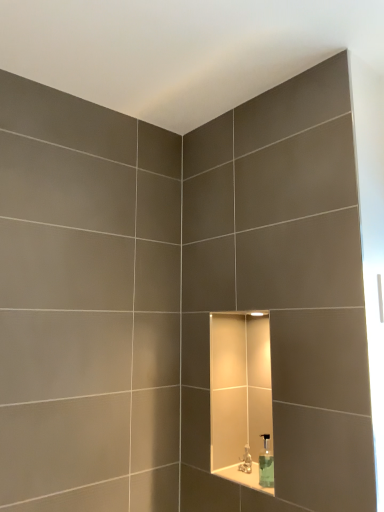
Question: Considering the relative positions of white glossy ledge at center and clear glass soap dispenser at center in the image provided, is white glossy ledge at center to the left of clear glass soap dispenser at center from the viewer's perspective?

Choices:
 (A) no
 (B) yes

Answer: (B)

Question: Does white glossy ledge at center have a greater height compared to clear glass soap dispenser at center?

Choices:
 (A) yes
 (B) no

Answer: (B)

Question: Is white glossy ledge at center directly adjacent to clear glass soap dispenser at center?

Choices:
 (A) no
 (B) yes

Answer: (B)

Question: Is white glossy ledge at center positioned with its back to clear glass soap dispenser at center?

Choices:
 (A) no
 (B) yes

Answer: (A)

Question: Does white glossy ledge at center have a larger size compared to clear glass soap dispenser at center?

Choices:
 (A) no
 (B) yes

Answer: (A)

Question: From the image's perspective, is white glossy ledge at center located above clear glass soap dispenser at center?

Choices:
 (A) no
 (B) yes

Answer: (A)

Question: Is white glossy ledge at center looking in the opposite direction of translucent plastic faucet at center?

Choices:
 (A) yes
 (B) no

Answer: (B)

Question: Does white glossy ledge at center lie behind translucent plastic faucet at center?

Choices:
 (A) yes
 (B) no

Answer: (B)

Question: Can you confirm if white glossy ledge at center is positioned to the left of translucent plastic faucet at center?

Choices:
 (A) no
 (B) yes

Answer: (A)

Question: Does white glossy ledge at center have a greater width compared to translucent plastic faucet at center?

Choices:
 (A) yes
 (B) no

Answer: (A)

Question: Is white glossy ledge at center at the right side of translucent plastic faucet at center?

Choices:
 (A) yes
 (B) no

Answer: (A)

Question: Can you confirm if white glossy ledge at center is bigger than translucent plastic faucet at center?

Choices:
 (A) yes
 (B) no

Answer: (A)

Question: Could you tell me if clear glass soap dispenser at center is turned towards white glossy ledge at center?

Choices:
 (A) no
 (B) yes

Answer: (A)